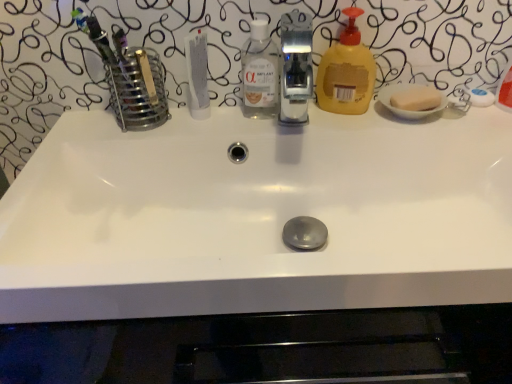
I want to click on vacant space that is to the left of satin nickel faucet at center, so click(218, 120).